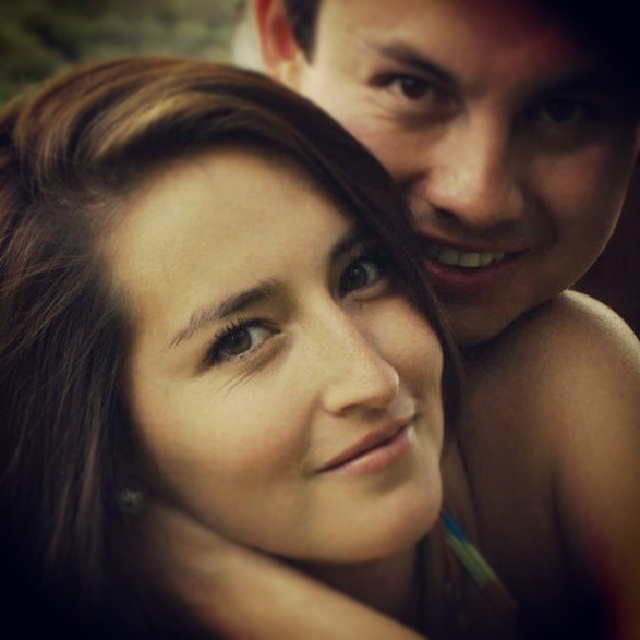
Consider the image. Is matte skin at center to the right of smooth skin face at upper right from the viewer's perspective?

In fact, matte skin at center is to the left of smooth skin face at upper right.

Between point (3, 240) and point (424, 150), which one is positioned behind?

The point (424, 150) is behind.

The image size is (640, 640). I want to click on matte skin at center, so click(214, 356).